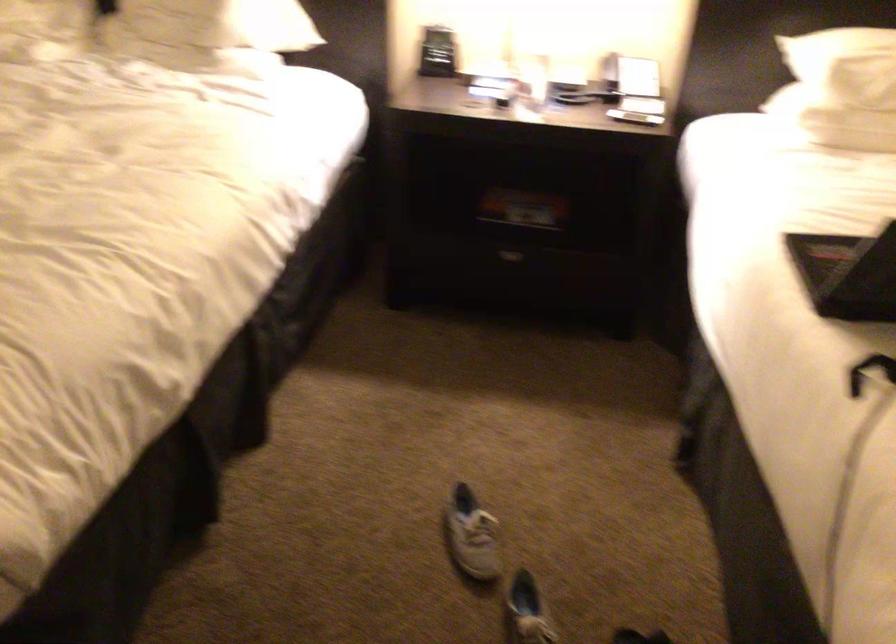
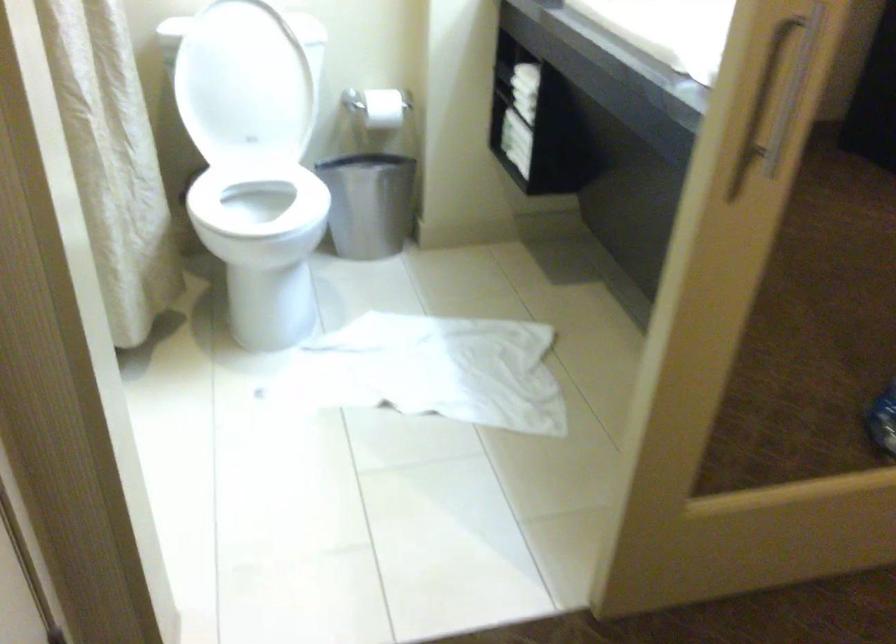
Question: The images are taken continuously from a first-person perspective. In which direction are you moving?

Choices:
 (A) Left
 (B) Right
 (C) Forward
 (D) Backward

Answer: (A)